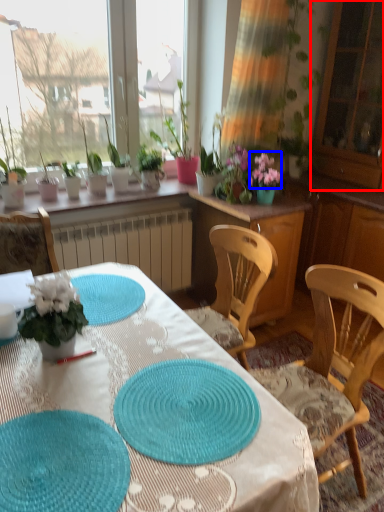
Question: Which object appears closest to the camera in this image, screen door (highlighted by a red box) or flower (highlighted by a blue box)?

Choices:
 (A) screen door
 (B) flower

Answer: (A)